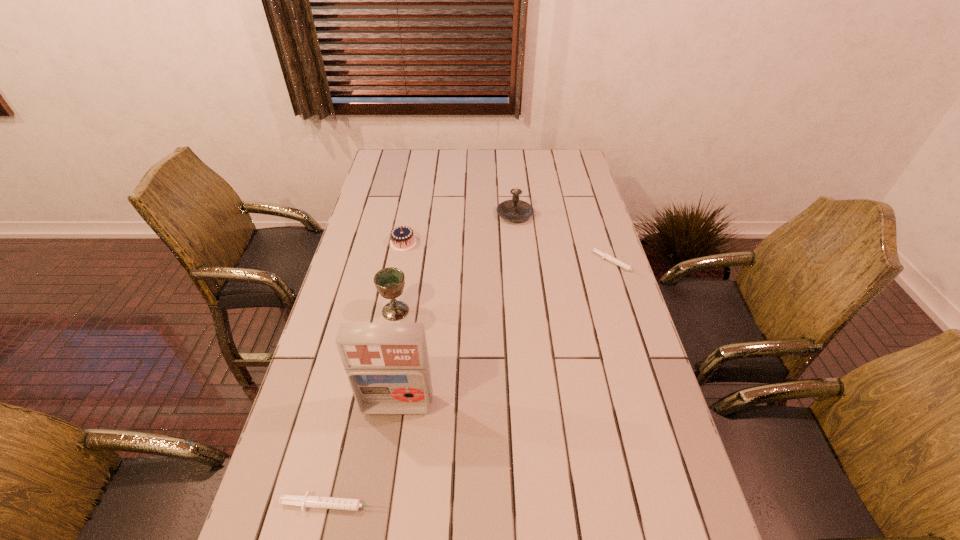
What are the coordinates of `free space located on the back of the taller syringe` in the screenshot? It's located at (370, 349).

Locate an element on the screen. This screenshot has width=960, height=540. vacant space located 0.060m on the back of the shorter syringe is located at coordinates (609, 240).

I want to click on vacant space located 0.270m on the front of the third nearest object, so click(378, 406).

Locate an element on the screen. Image resolution: width=960 pixels, height=540 pixels. vacant space located on the left of the chocolate cake is located at coordinates (359, 242).

Image resolution: width=960 pixels, height=540 pixels. I want to click on free location located on the front of the candle, so click(x=517, y=239).

You are a GUI agent. You are given a task and a screenshot of the screen. Output one action in this format:
    pyautogui.click(x=<x>, y=<y>)
    Task: Click on the vacant space situated 0.250m on the front-facing side of the first-aid kit
    
    Given the screenshot: What is the action you would take?
    pyautogui.click(x=378, y=529)

You are a GUI agent. You are given a task and a screenshot of the screen. Output one action in this format:
    pyautogui.click(x=<x>, y=<y>)
    Task: Click on the object present at the near edge
    This screenshot has height=540, width=960.
    Given the screenshot: What is the action you would take?
    pyautogui.click(x=349, y=504)

I want to click on syringe at the left edge, so 349,504.

Find the location of `chalice located in the left edge section of the desktop`. chalice located in the left edge section of the desktop is located at coordinates (389, 282).

I want to click on chocolate cake that is at the left edge, so click(402, 238).